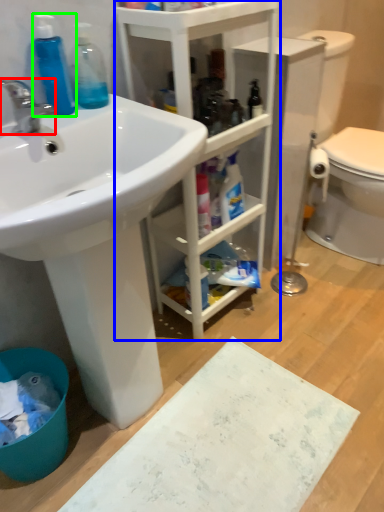
Question: Which object is positioned closest to tap (highlighted by a red box)? Select from bathroom cabinet (highlighted by a blue box) and cleaning product (highlighted by a green box).

Choices:
 (A) bathroom cabinet
 (B) cleaning product

Answer: (B)